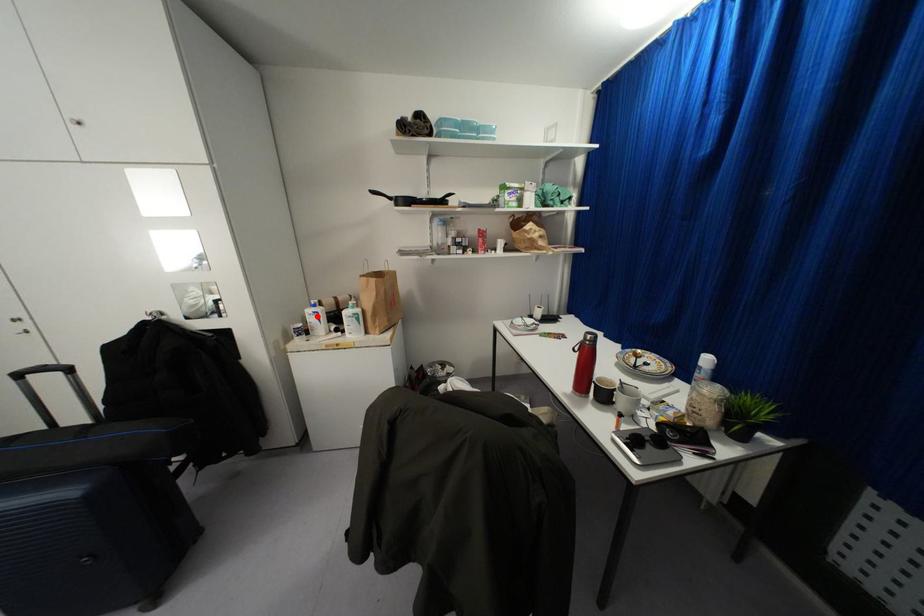
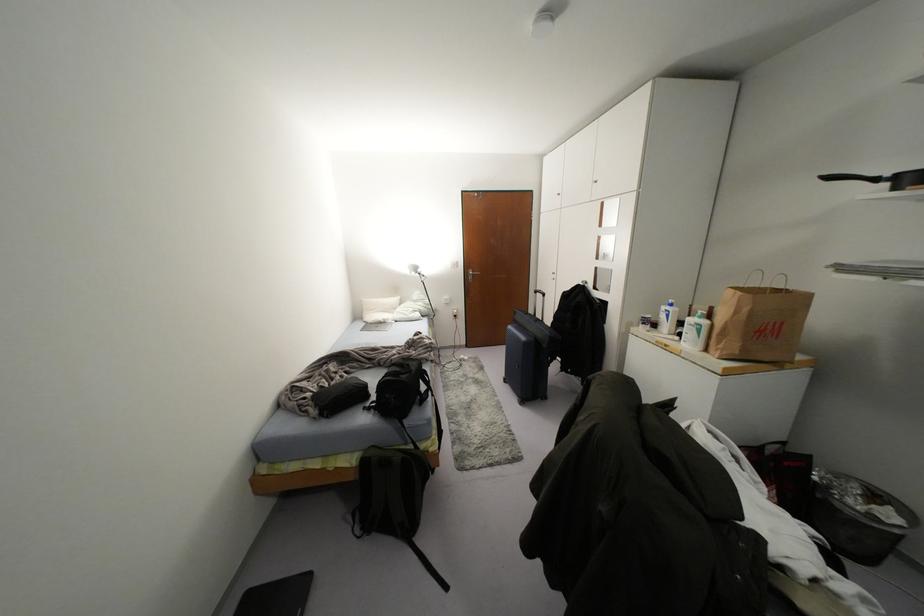
Locate, in the second image, the point that corresponds to the highlighted location in the first image.

(666, 315)